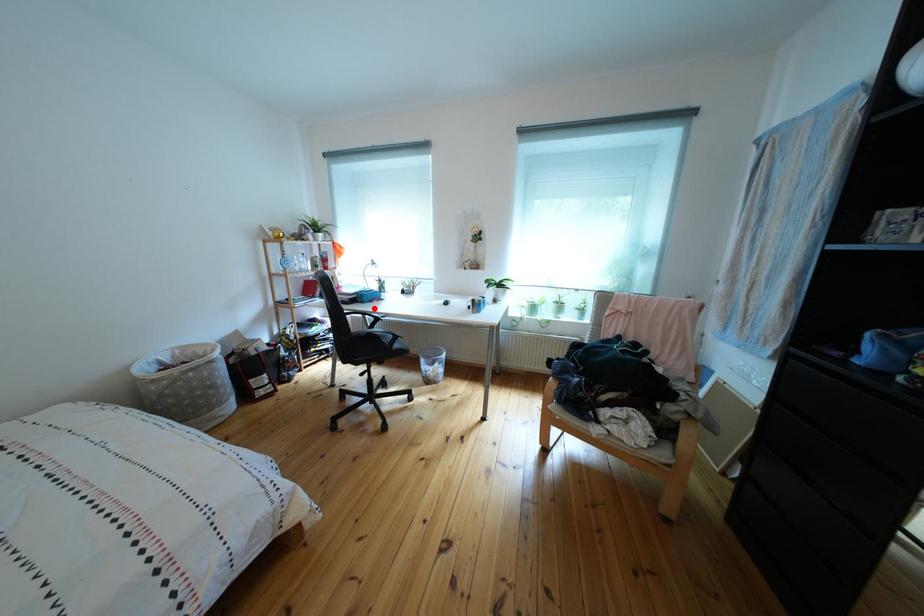
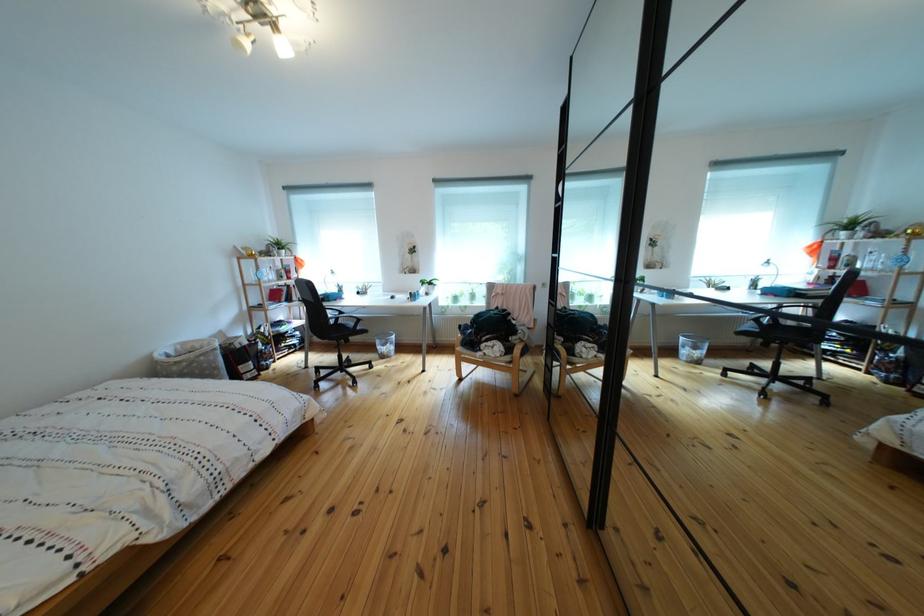
In the second image, find the point that corresponds to the highlighted location in the first image.

(341, 307)